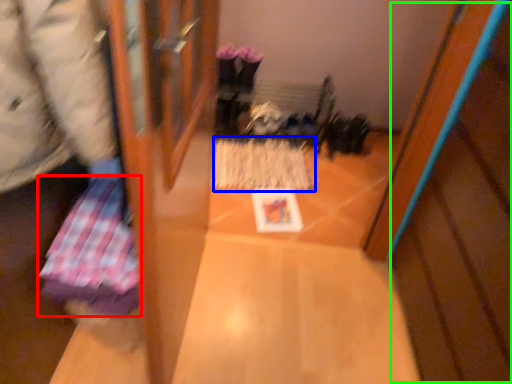
Question: Which object is the farthest from wrapping paper (highlighted by a red box)? Choose among these: wrapping paper (highlighted by a blue box) or wood (highlighted by a green box).

Choices:
 (A) wrapping paper
 (B) wood

Answer: (A)